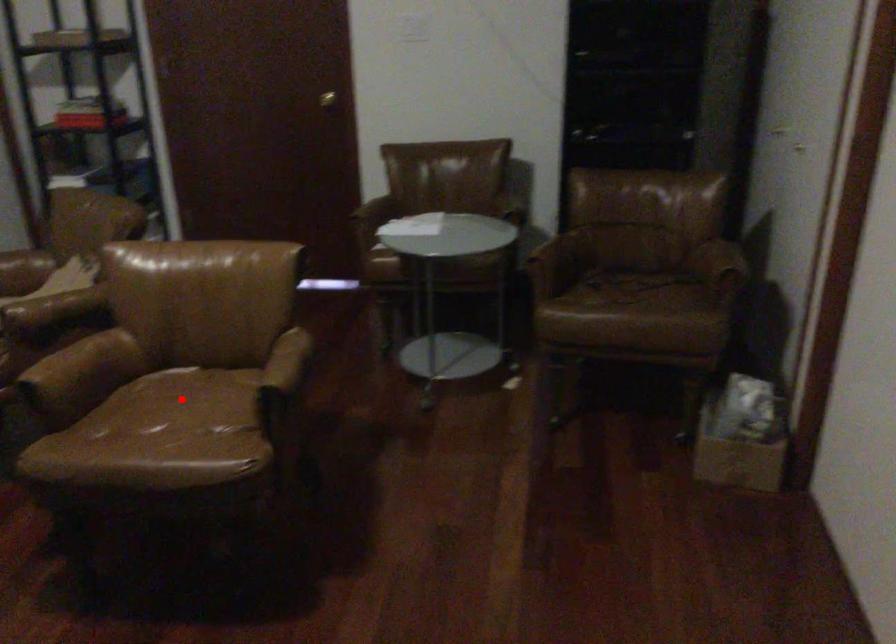
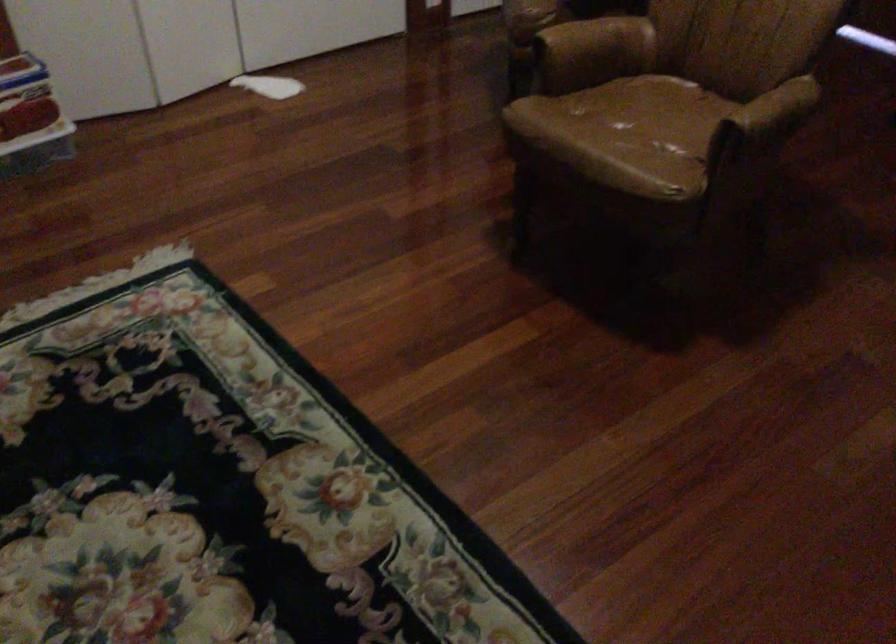
Find the pixel in the second image that matches the highlighted location in the first image.

(661, 109)